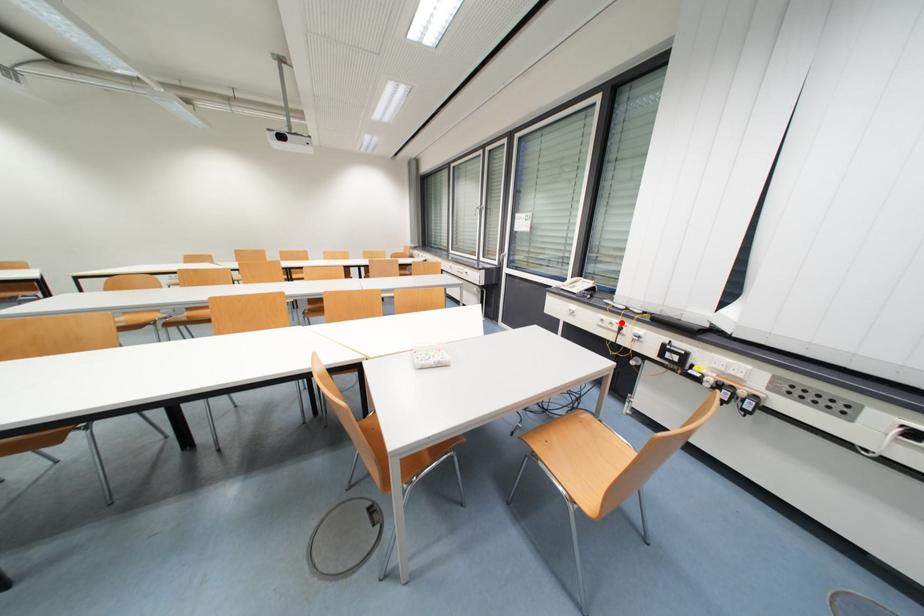
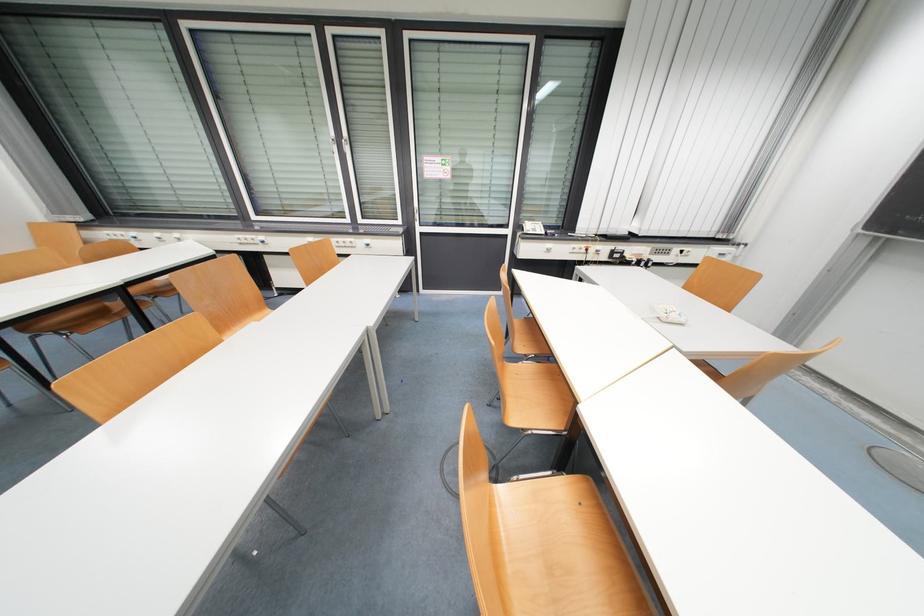
Question: I am providing you with two images of the same scene from different viewpoints. In image1, a red point is highlighted. Considering the same 3D point in image2, which of the following is correct?

Choices:
 (A) It is closer
 (B) It is farther

Answer: (A)